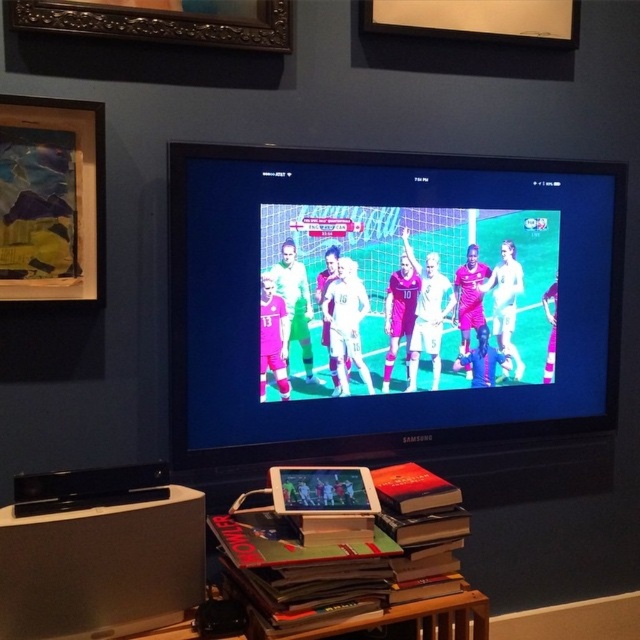
Question: Where is wooden-framed artwork at upper left located in relation to matte wood frame at upper center in the image?

Choices:
 (A) right
 (B) left

Answer: (B)

Question: Which of these objects is positioned farthest from the wooden-framed artwork at upper left?

Choices:
 (A) pink fabric soccer players at center
 (B) matte wood frame at upper center
 (C) matte plastic television at center
 (D) wooden carved frame at upper left

Answer: (B)

Question: Which point is farther to the camera?

Choices:
 (A) wooden carved frame at upper left
 (B) matte wood frame at upper center
 (C) pink fabric soccer players at center
 (D) wooden-framed artwork at upper left

Answer: (B)

Question: Does matte plastic television at center have a greater width compared to wooden carved frame at upper left?

Choices:
 (A) no
 (B) yes

Answer: (B)

Question: In this image, where is matte plastic television at center located relative to wooden carved frame at upper left?

Choices:
 (A) left
 (B) right

Answer: (B)

Question: Which point is closer to the camera?

Choices:
 (A) (371, 8)
 (B) (364, 369)
 (C) (154, 36)
 (D) (72, 180)

Answer: (D)